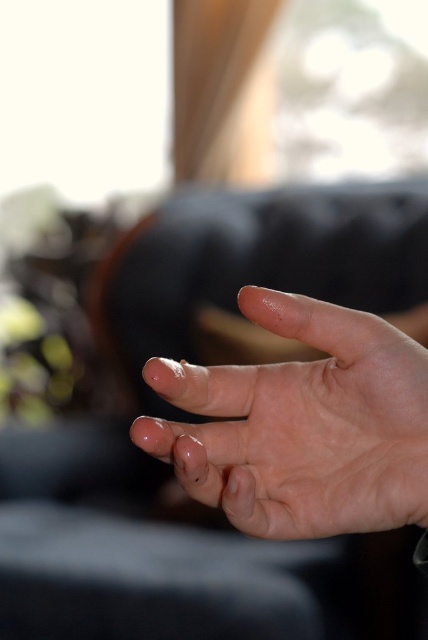
You are taking a photo of a hand with a camera. You notice two points on the hand at coordinates point (184,458) and point (165,428). Which point will appear larger in your photo?

Point (184,458) is closer to the camera than point (165,428), so it will appear larger in the photo.

You are a photographer setting up a shoot in a room with the described scene. You need to position a small prop between the smooth skin hand at center and the clear skin toe at center. Based on their positions, where should you place the prop to ensure it is between them?

The smooth skin hand at center is below the clear skin toe at center, so you should place the prop between them by positioning it above the hand and below the toe.